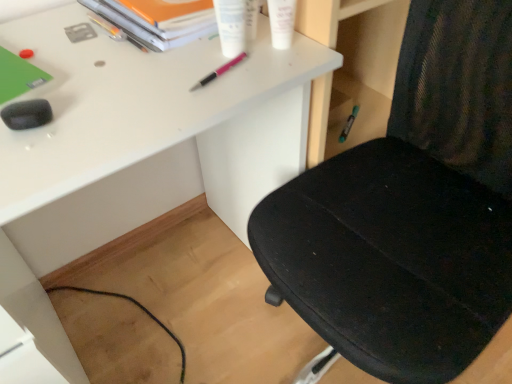
Where is `vacant space that's between pink metallic pen at upper center, the 4th stationery when ordered from right to left, and metallic silver pen at upper left, placed as the 2th stationery when sorted from back to front`? This screenshot has height=384, width=512. vacant space that's between pink metallic pen at upper center, the 4th stationery when ordered from right to left, and metallic silver pen at upper left, placed as the 2th stationery when sorted from back to front is located at coordinates (167, 46).